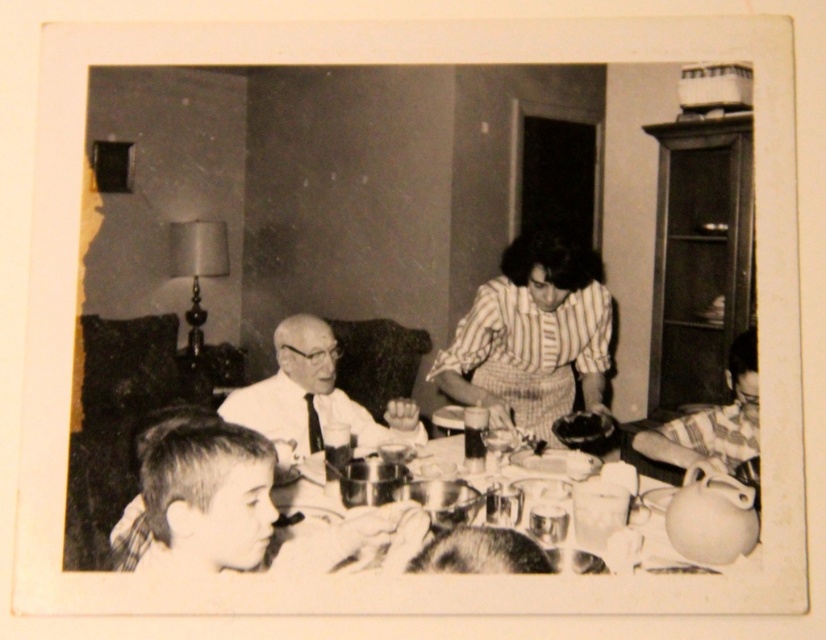
You are a photographer analyzing this black and white image of a family gathering. You notice two distinct features at the lower part of the image. One is the short hair at lower left and the other is the striped fabric shirt at lower right. Based on their positions, which feature appears closer to the camera?

The short hair at lower left appears closer to the camera because it is not as tall as the striped fabric shirt at lower right, meaning it occupies a lower vertical position in the frame.

What is located at the point with coordinates (437,454) in the image?

The point at coordinates (437,454) is located on the striped fabric shirt at center.

In the family gathering scene, there is a striped fabric shirt at center and metallic reflective tableware at center. Which object takes up more space in the image?

The striped fabric shirt at center is bigger than metallic reflective tableware at center, so it takes up more space in the image.